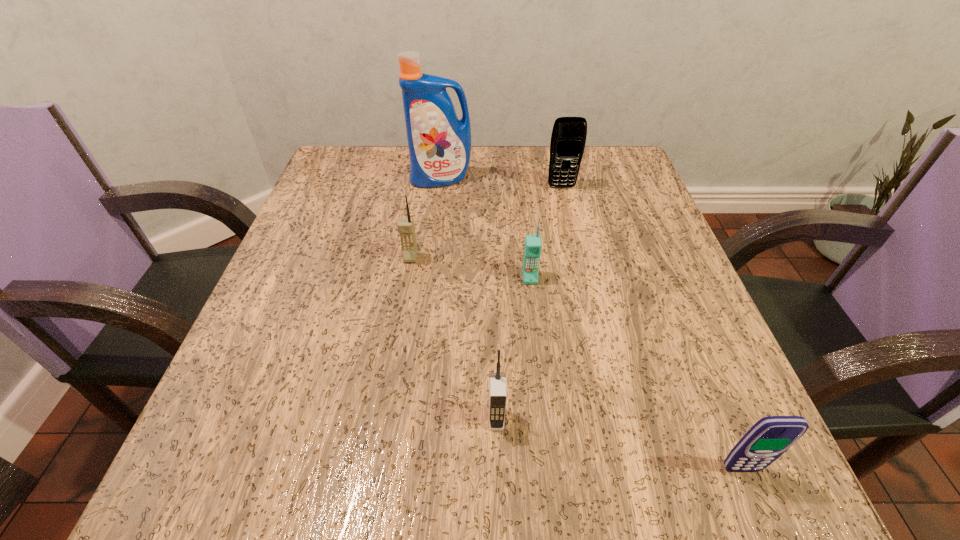
I want to click on the nearest object, so click(770, 437).

The width and height of the screenshot is (960, 540). In order to click on free space located on the label of the tallest object in this screenshot , I will do `click(429, 284)`.

The height and width of the screenshot is (540, 960). Identify the location of free location located on the screen of the farthest cellular telephone. (583, 279).

The image size is (960, 540). What are the coordinates of `free region located 0.160m on the front of the leftmost cellular telephone, where the keypad is located` in the screenshot? It's located at (398, 332).

The image size is (960, 540). In order to click on free space located on the keypad of the third farthest cellular telephone in this screenshot , I will do `click(544, 402)`.

At what (x,y) coordinates should I click in order to perform the action: click on detergent that is at the far edge. Please return your answer as a coordinate pair (x, y). Image resolution: width=960 pixels, height=540 pixels. Looking at the image, I should click on (439, 143).

Identify the location of cellular telephone that is at the far edge. (568, 139).

Locate an element on the screen. This screenshot has height=540, width=960. object that is at the near edge is located at coordinates (770, 437).

I want to click on object at the far right corner, so click(568, 139).

Locate an element on the screen. This screenshot has width=960, height=540. object located in the near right corner section of the desktop is located at coordinates (770, 437).